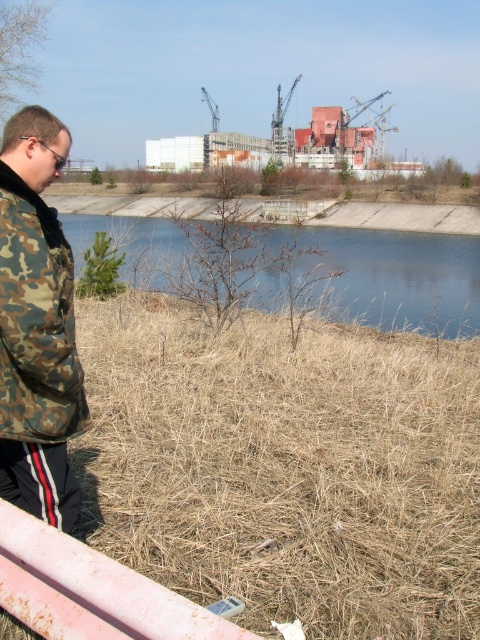
Question: Can you confirm if camo jacket at left is smaller than blue water at center?

Choices:
 (A) yes
 (B) no

Answer: (A)

Question: Among these objects, which one is nearest to the camera?

Choices:
 (A) camo jacket at left
 (B) blue water at center

Answer: (A)

Question: Is camo jacket at left further to camera compared to blue water at center?

Choices:
 (A) no
 (B) yes

Answer: (A)

Question: Which object is farther from the camera taking this photo?

Choices:
 (A) blue water at center
 (B) camo jacket at left

Answer: (A)

Question: Is camo jacket at left closer to the viewer compared to blue water at center?

Choices:
 (A) yes
 (B) no

Answer: (A)